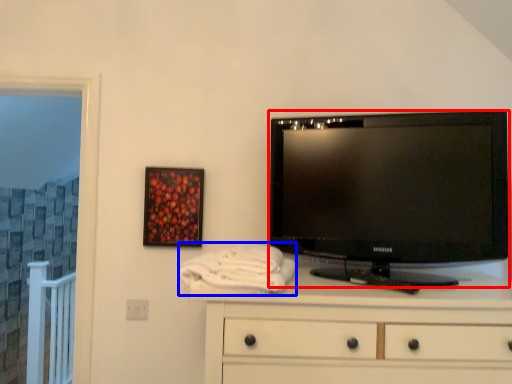
Question: Which point is closer to the camera, television (highlighted by a red box) or bath towel (highlighted by a blue box)?

Choices:
 (A) television
 (B) bath towel

Answer: (B)